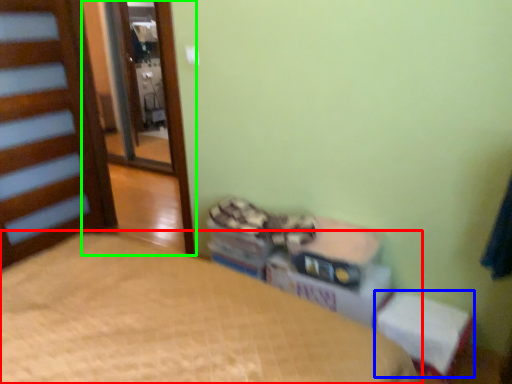
Question: Estimate the real-world distances between objects in this image. Which object is farther from bed (highlighted by a red box), changing table (highlighted by a blue box) or screen door (highlighted by a green box)?

Choices:
 (A) changing table
 (B) screen door

Answer: (B)